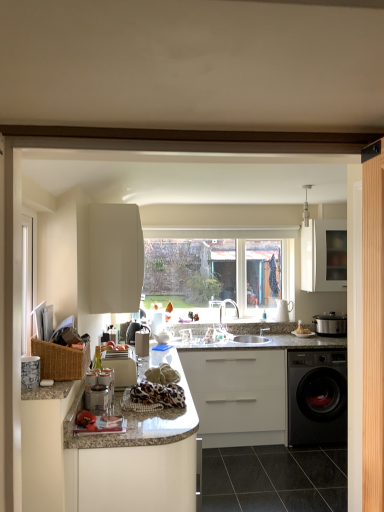
Question: Does woven brown basket at left have a greater height compared to white matte cabinet at upper center, which is counted as the 1th cabinetry, starting from the left?

Choices:
 (A) no
 (B) yes

Answer: (A)

Question: Does woven brown basket at left touch white matte cabinet at upper center, the 4th cabinetry viewed from the right?

Choices:
 (A) no
 (B) yes

Answer: (A)

Question: Is white matte cabinet at upper center, which is counted as the 1th cabinetry, starting from the left, inside woven brown basket at left?

Choices:
 (A) no
 (B) yes

Answer: (A)

Question: Is woven brown basket at left not near white matte cabinet at upper center, the 4th cabinetry viewed from the right?

Choices:
 (A) no
 (B) yes

Answer: (A)

Question: Could you tell me if woven brown basket at left is turned towards white matte cabinet at upper center, the 4th cabinetry viewed from the right?

Choices:
 (A) no
 (B) yes

Answer: (A)

Question: From a real-world perspective, relative to matte white toaster at center, which ranks as the 1th appliance in front-to-back order, is light wood barn door at right vertically above or below?

Choices:
 (A) below
 (B) above

Answer: (B)

Question: Do you think light wood barn door at right is within matte white toaster at center, marked as the first appliance in a left-to-right arrangement, or outside of it?

Choices:
 (A) outside
 (B) inside

Answer: (A)

Question: From the image's perspective, is light wood barn door at right located above or below matte white toaster at center, arranged as the second appliance when viewed from the right?

Choices:
 (A) below
 (B) above

Answer: (B)

Question: Is point (380, 439) closer or farther from the camera than point (115, 371)?

Choices:
 (A) closer
 (B) farther

Answer: (A)

Question: Looking at the image, does matte silver slow cooker at right, acting as the first appliance starting from the right, seem bigger or smaller compared to granite countertop at center?

Choices:
 (A) big
 (B) small

Answer: (B)

Question: Is matte silver slow cooker at right, acting as the first appliance starting from the right, wider or thinner than granite countertop at center?

Choices:
 (A) wide
 (B) thin

Answer: (B)

Question: From the image's perspective, is matte silver slow cooker at right, the 2th appliance positioned from the left, positioned above or below granite countertop at center?

Choices:
 (A) above
 (B) below

Answer: (A)

Question: In terms of height, does matte silver slow cooker at right, arranged as the second appliance when viewed from the front, look taller or shorter compared to granite countertop at center?

Choices:
 (A) tall
 (B) short

Answer: (B)

Question: From a real-world perspective, is satin nickel faucet at center physically located above or below black glossy washing machine at lower right?

Choices:
 (A) above
 (B) below

Answer: (A)

Question: Is satin nickel faucet at center inside the boundaries of black glossy washing machine at lower right, or outside?

Choices:
 (A) outside
 (B) inside

Answer: (A)